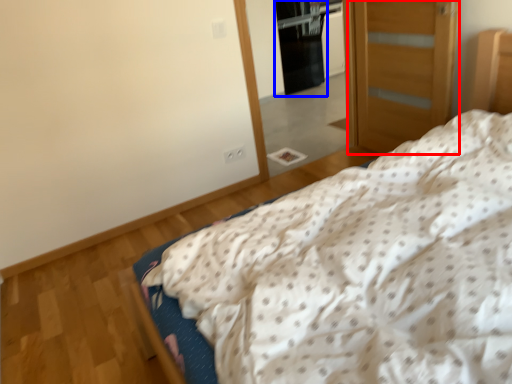
Question: Which of the following is the closest to the observer, door (highlighted by a red box) or screen door (highlighted by a blue box)?

Choices:
 (A) door
 (B) screen door

Answer: (A)